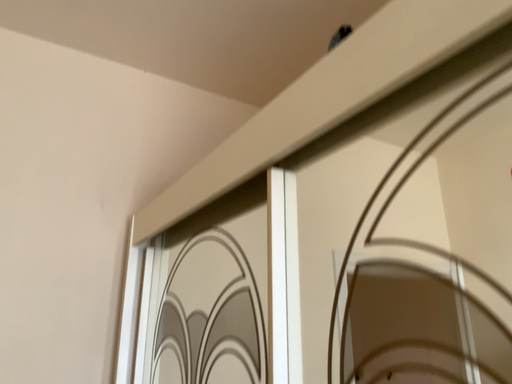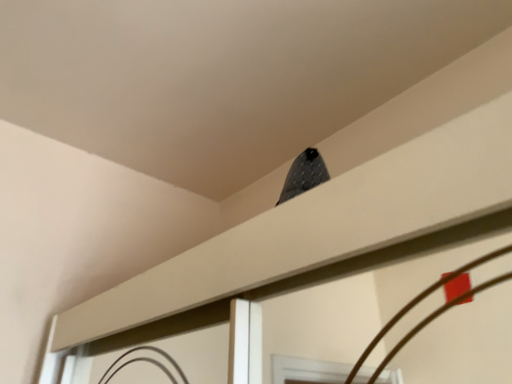
Question: Which way did the camera rotate in the video?

Choices:
 (A) rotated upward
 (B) rotated downward

Answer: (A)